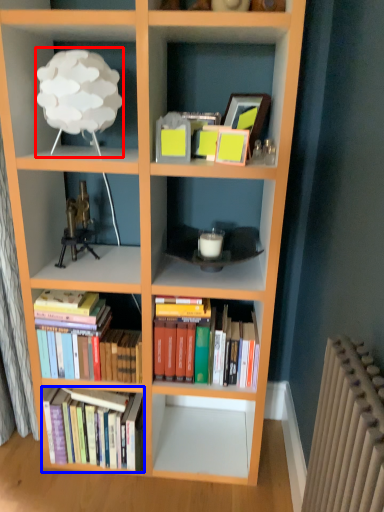
Question: Which point is further to the camera, lamp (highlighted by a red box) or book (highlighted by a blue box)?

Choices:
 (A) lamp
 (B) book

Answer: (B)